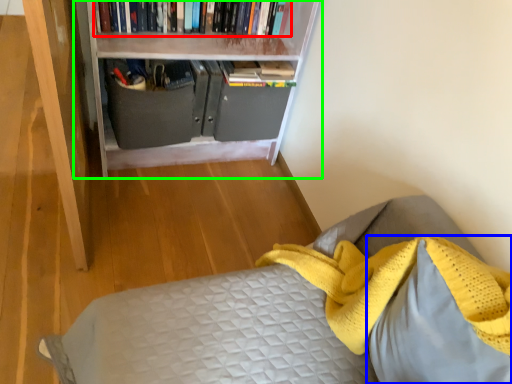
Question: Which is farther away from book (highlighted by a red box)? pillow (highlighted by a blue box) or bookcase (highlighted by a green box)?

Choices:
 (A) pillow
 (B) bookcase

Answer: (A)